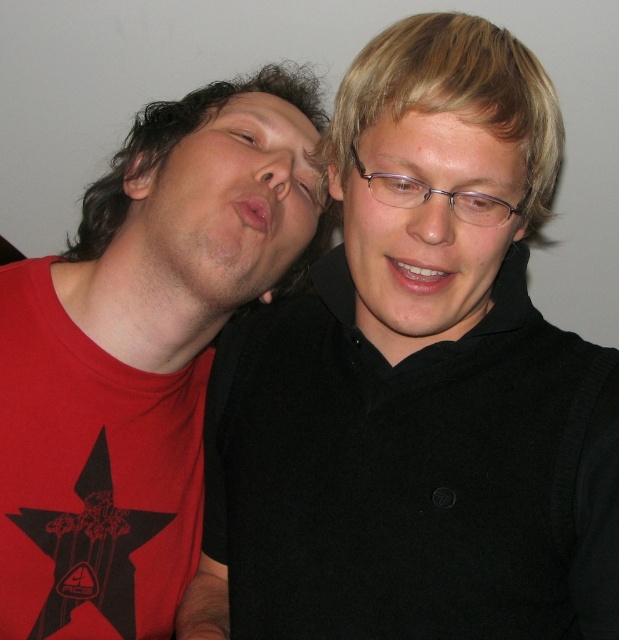
Question: Does matte black glasses at center appear on the left side of translucent plastic eye at center?

Choices:
 (A) yes
 (B) no

Answer: (A)

Question: Among these points, which one is farthest from the camera?

Choices:
 (A) (193, 250)
 (B) (241, 128)
 (C) (524, 602)
 (D) (207, 96)

Answer: (D)

Question: Is matte red shirt at left positioned in front of clear plastic eye at center?

Choices:
 (A) no
 (B) yes

Answer: (A)

Question: Which object appears farthest from the camera in this image?

Choices:
 (A) clear plastic eye at center
 (B) matte red t-shirt at left
 (C) matte red shirt at left

Answer: (B)

Question: Which point appears closest to the camera in this image?

Choices:
 (A) (516, 177)
 (B) (478, 196)
 (C) (381, 188)
 (D) (280, 196)

Answer: (B)

Question: Does matte red t-shirt at left come behind clear plastic eye at center?

Choices:
 (A) no
 (B) yes

Answer: (B)